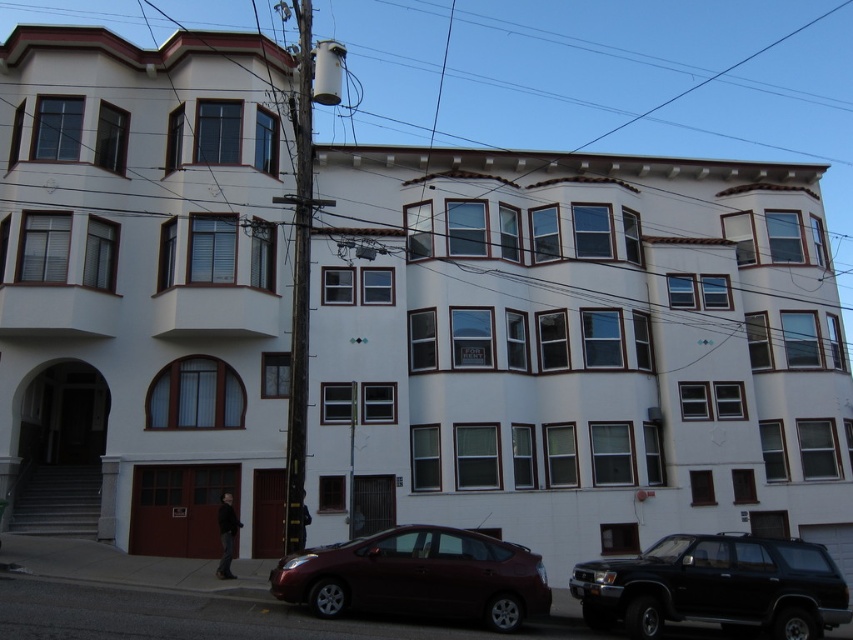
Between black matte suv at lower right and shiny maroon sedan at lower center, which one appears on the left side from the viewer's perspective?

From the viewer's perspective, shiny maroon sedan at lower center appears more on the left side.

Identify the location of black matte suv at lower right. click(x=717, y=586).

You are a GUI agent. You are given a task and a screenshot of the screen. Output one action in this format:
    pyautogui.click(x=<x>, y=<y>)
    Task: Click on the black matte suv at lower right
    The width and height of the screenshot is (853, 640).
    Given the screenshot: What is the action you would take?
    point(717,586)

You are a GUI agent. You are given a task and a screenshot of the screen. Output one action in this format:
    pyautogui.click(x=<x>, y=<y>)
    Task: Click on the black matte suv at lower right
    
    Given the screenshot: What is the action you would take?
    pyautogui.click(x=717, y=586)